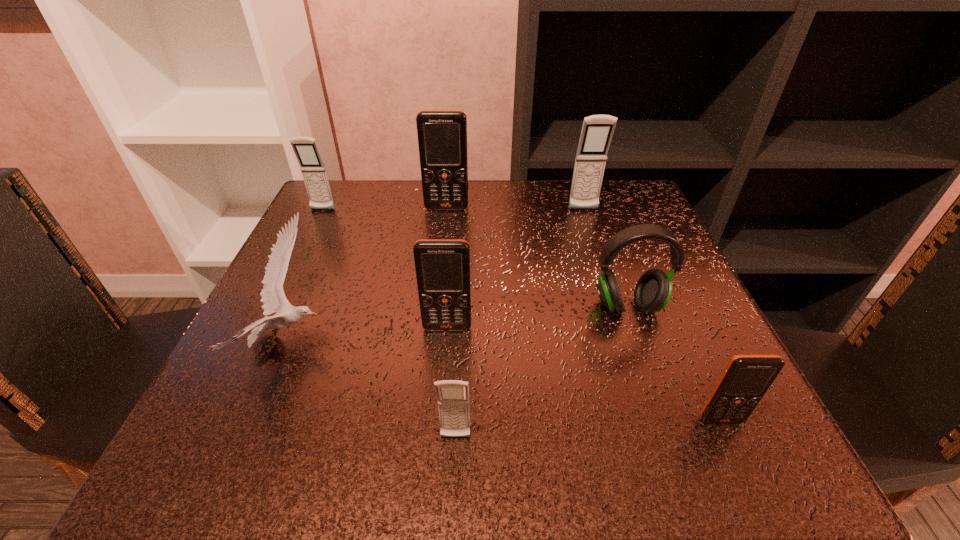
The image size is (960, 540). I want to click on the second cellular telephone from right to left, so click(597, 130).

Find the location of a particular element. the biggest gray cellular telephone is located at coordinates (597, 130).

You are a GUI agent. You are given a task and a screenshot of the screen. Output one action in this format:
    pyautogui.click(x=<x>, y=<y>)
    Task: Click on the farthest orange cellular telephone
    
    Given the screenshot: What is the action you would take?
    pyautogui.click(x=442, y=135)

The image size is (960, 540). I want to click on the second biggest gray cellular telephone, so click(306, 150).

Where is `the leftmost gray cellular telephone`? the leftmost gray cellular telephone is located at coordinates (306, 150).

Locate an element on the screen. The image size is (960, 540). the third nearest cellular telephone is located at coordinates (442, 266).

Identify the location of the second biggest orange cellular telephone. point(442,266).

Identify the location of headset. The height and width of the screenshot is (540, 960). (653, 290).

The width and height of the screenshot is (960, 540). In order to click on gull in this screenshot , I will do `click(273, 298)`.

The width and height of the screenshot is (960, 540). In order to click on the rightmost cellular telephone in this screenshot , I will do `click(746, 378)`.